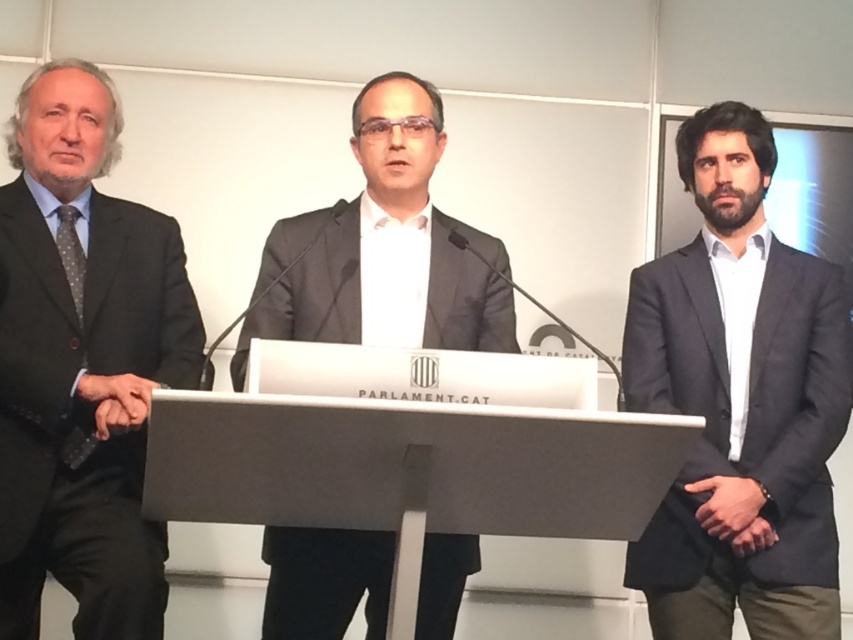
Who is more distant from viewer, (654, 518) or (134, 358)?

The point (654, 518) is more distant.

This screenshot has width=853, height=640. What do you see at coordinates (740, 403) in the screenshot? I see `dark gray suit at right` at bounding box center [740, 403].

Describe the element at coordinates (740, 403) in the screenshot. This screenshot has width=853, height=640. I see `dark gray suit at right` at that location.

Locate an element on the screen. Image resolution: width=853 pixels, height=640 pixels. dark gray suit at right is located at coordinates (740, 403).

Does dark gray suit at right lie in front of white matte podium at center?

No, it is not.

Does point (694, 307) come in front of point (393, 592)?

That is False.

This screenshot has width=853, height=640. What do you see at coordinates (740, 403) in the screenshot? I see `dark gray suit at right` at bounding box center [740, 403].

Identify the location of dark gray suit at right. (740, 403).

Is dark gray suit at right shorter than matte gray suit at center?

Incorrect, dark gray suit at right's height does not fall short of matte gray suit at center's.

Is dark gray suit at right thinner than matte gray suit at center?

Yes, dark gray suit at right is thinner than matte gray suit at center.

Which is behind, point (776, 508) or point (335, 246)?

Positioned behind is point (335, 246).

Locate an element on the screen. dark gray suit at right is located at coordinates (740, 403).